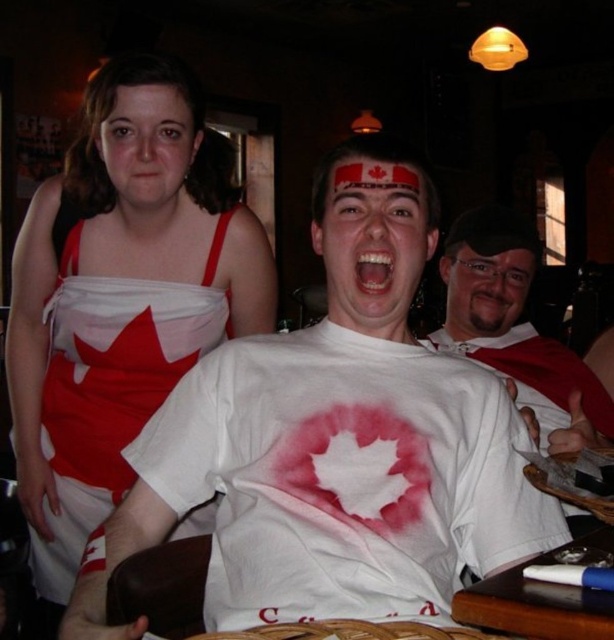
Question: From the image, what is the correct spatial relationship of white matte shirt at center in relation to matte white face at center?

Choices:
 (A) left
 (B) right

Answer: (B)

Question: Which point is closer to the camera?

Choices:
 (A) (349, 278)
 (B) (480, 330)
 (C) (231, 324)

Answer: (A)

Question: Is white matte t-shirt at center wider than white satin dress at upper left?

Choices:
 (A) yes
 (B) no

Answer: (A)

Question: Estimate the real-world distances between objects in this image. Which object is farther from the matte plastic face at center?

Choices:
 (A) white satin dress at upper left
 (B) white matte shirt at center

Answer: (A)

Question: Which point is closer to the camera?

Choices:
 (A) white matte t-shirt at center
 (B) matte white face at upper left

Answer: (A)

Question: Can you confirm if white satin dress at upper left is bigger than matte white face at upper left?

Choices:
 (A) yes
 (B) no

Answer: (A)